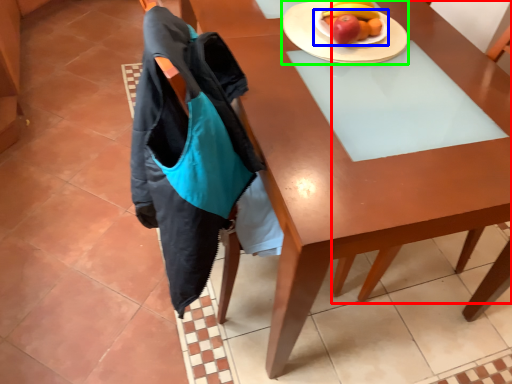
Question: Considering the real-world distances, which object is farthest from chair (highlighted by a red box)? plate (highlighted by a blue box) or plate (highlighted by a green box)?

Choices:
 (A) plate
 (B) plate

Answer: (A)